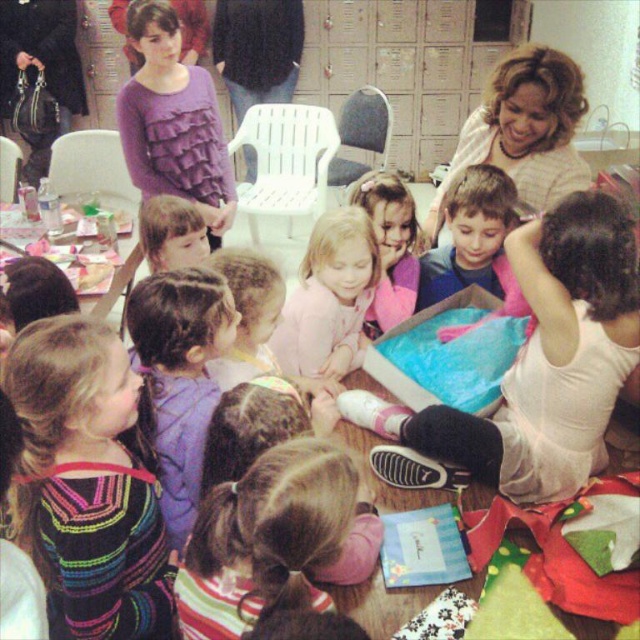
Question: Which object is positioned farthest from the smooth blue shirt at center?

Choices:
 (A) multicolored striped shirt at lower center
 (B) blonde hair at upper right
 (C) multicolored knitted sweater at lower left
 (D) pastel pink fabric at center

Answer: (C)

Question: Can you confirm if multicolored knitted sweater at lower left is smaller than purple ruffled shirt at upper left?

Choices:
 (A) no
 (B) yes

Answer: (B)

Question: Estimate the real-world distances between objects in this image. Which object is closer to the matte purple sweater at upper left?

Choices:
 (A) multicolored knitted sweater at lower left
 (B) smooth blue shirt at center
 (C) smooth pink sweater at center
 (D) light purple sweater at center

Answer: (B)

Question: Is pastel pink fabric at center positioned at the back of matte purple sweater at upper left?

Choices:
 (A) no
 (B) yes

Answer: (A)

Question: Is pink fabric at center smaller than blonde hair at upper right?

Choices:
 (A) no
 (B) yes

Answer: (A)

Question: Which object is closer to the camera taking this photo?

Choices:
 (A) smooth blue shirt at center
 (B) matte purple sweater at upper left
 (C) pink fabric dress at center

Answer: (A)